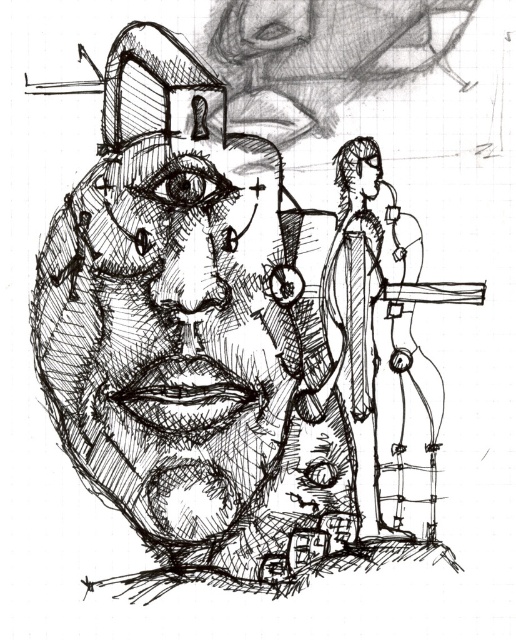
Question: Is black ink drawing of face at center behind smooth black head at upper right?

Choices:
 (A) no
 (B) yes

Answer: (A)

Question: Which point is closer to the camera taking this photo?

Choices:
 (A) coord(350,150)
 (B) coord(159,259)

Answer: (B)

Question: Can you confirm if black ink drawing of face at center is smaller than smooth black head at upper right?

Choices:
 (A) no
 (B) yes

Answer: (A)

Question: Among these points, which one is farthest from the camera?

Choices:
 (A) (231, 188)
 (B) (367, 193)

Answer: (B)

Question: Is black ink drawing of face at center to the right of smooth black head at upper right from the viewer's perspective?

Choices:
 (A) no
 (B) yes

Answer: (A)